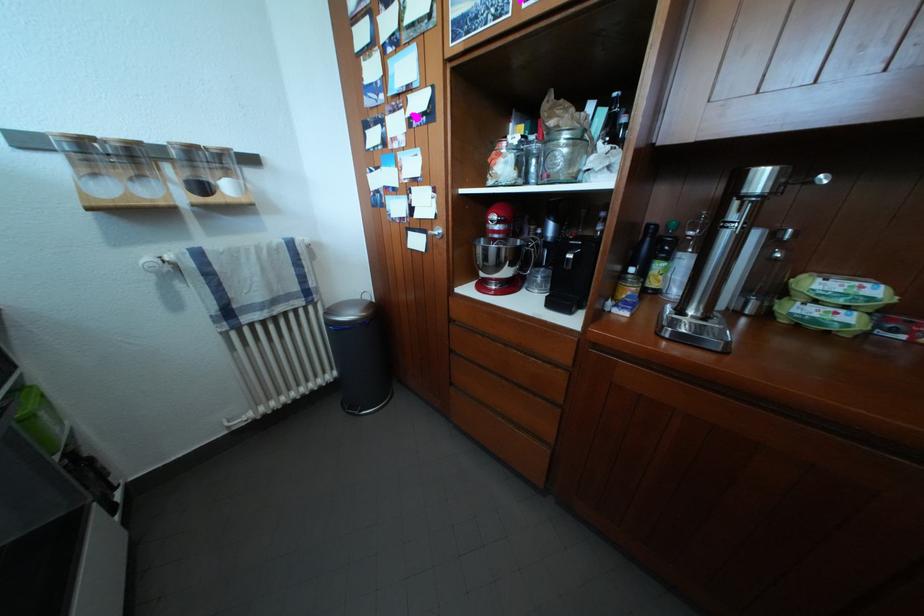
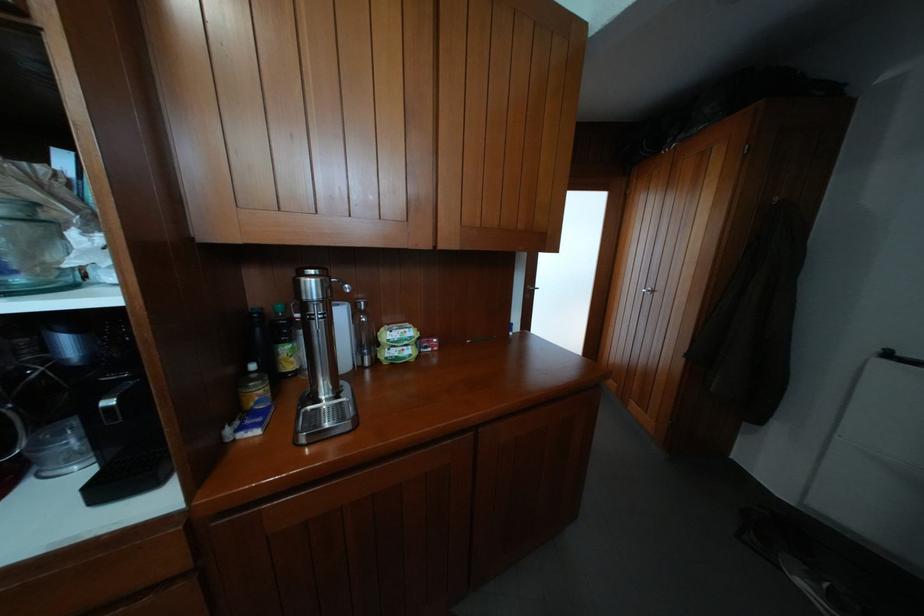
The point at (x=667, y=272) is marked in the first image. Where is the corresponding point in the second image?

(293, 355)